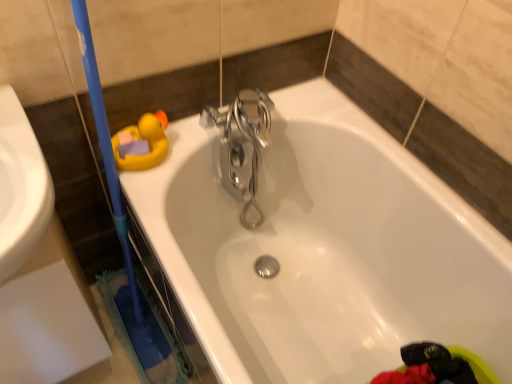
Question: Can you confirm if polished chrome faucet at center is taller than white glossy bathtub at upper center?

Choices:
 (A) yes
 (B) no

Answer: (B)

Question: Considering the relative sizes of polished chrome faucet at center and white glossy bathtub at upper center in the image provided, is polished chrome faucet at center thinner than white glossy bathtub at upper center?

Choices:
 (A) yes
 (B) no

Answer: (A)

Question: Is polished chrome faucet at center bigger than white glossy bathtub at upper center?

Choices:
 (A) yes
 (B) no

Answer: (B)

Question: Is polished chrome faucet at center touching white glossy bathtub at upper center?

Choices:
 (A) yes
 (B) no

Answer: (B)

Question: Is polished chrome faucet at center closer to camera compared to white glossy bathtub at upper center?

Choices:
 (A) yes
 (B) no

Answer: (B)

Question: Considering the relative sizes of polished chrome faucet at center and white glossy bathtub at upper center in the image provided, is polished chrome faucet at center shorter than white glossy bathtub at upper center?

Choices:
 (A) yes
 (B) no

Answer: (A)

Question: Does white glossy bathtub at upper center appear on the right side of polished chrome faucet at center?

Choices:
 (A) yes
 (B) no

Answer: (A)

Question: Can you confirm if white glossy bathtub at upper center is taller than polished chrome faucet at center?

Choices:
 (A) yes
 (B) no

Answer: (A)

Question: Is polished chrome faucet at center located within white glossy bathtub at upper center?

Choices:
 (A) no
 (B) yes

Answer: (B)

Question: From the image's perspective, does white glossy bathtub at upper center appear higher than polished chrome faucet at center?

Choices:
 (A) no
 (B) yes

Answer: (A)

Question: Is white glossy bathtub at upper center closer to the viewer compared to polished chrome faucet at center?

Choices:
 (A) yes
 (B) no

Answer: (A)

Question: Is white glossy bathtub at upper center aimed at polished chrome faucet at center?

Choices:
 (A) yes
 (B) no

Answer: (B)

Question: Relative to polished chrome faucet at center, is white glossy bathtub at upper center in front or behind?

Choices:
 (A) front
 (B) behind

Answer: (A)